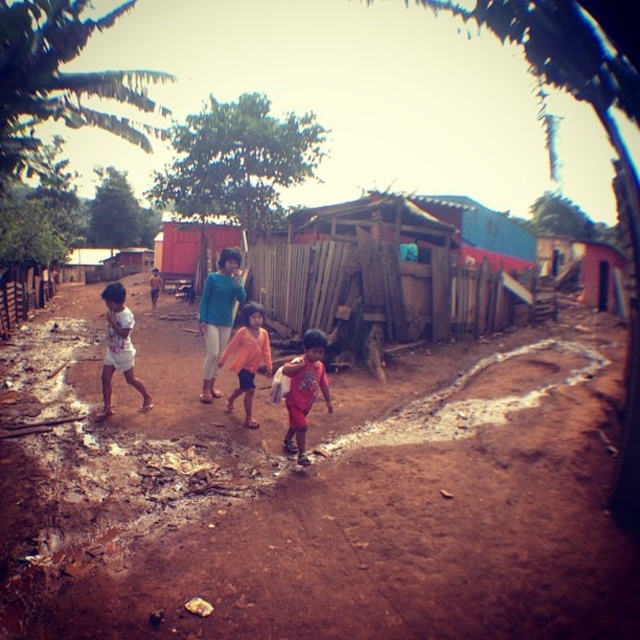
Is white cotton shirt at left wider than orange cotton shirt at center?

Yes, white cotton shirt at left is wider than orange cotton shirt at center.

From the picture: Can you confirm if white cotton shirt at left is taller than orange cotton shirt at center?

Yes, white cotton shirt at left is taller than orange cotton shirt at center.

Between point (108, 368) and point (230, 392), which one is positioned behind?

The point (230, 392) is behind.

I want to click on white cotton shirt at left, so click(x=118, y=348).

Can you confirm if brown dirt field at center is smaller than red matte shirt at center?

Actually, brown dirt field at center might be larger than red matte shirt at center.

Who is positioned more to the left, brown dirt field at center or red matte shirt at center?

brown dirt field at center

Who is more forward, (76, 616) or (300, 364)?

Point (76, 616)

In order to click on brown dirt field at center in this screenshot , I will do `click(316, 496)`.

Is brown dirt field at center shorter than orange cotton shirt at center?

Yes, brown dirt field at center is shorter than orange cotton shirt at center.

Who is positioned more to the left, brown dirt field at center or orange cotton shirt at center?

brown dirt field at center is more to the left.

Measure the distance between brown dirt field at center and camera.

They are 9.35 feet apart.

Where is `brown dirt field at center`? The width and height of the screenshot is (640, 640). brown dirt field at center is located at coordinates 316,496.